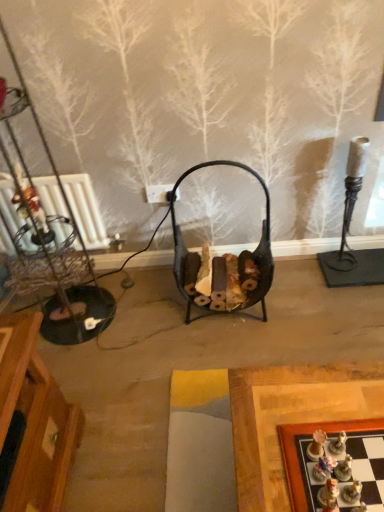
Where is `vacant space behind matte plastic chess piece at lower right`? This screenshot has height=512, width=384. vacant space behind matte plastic chess piece at lower right is located at coordinates (312, 458).